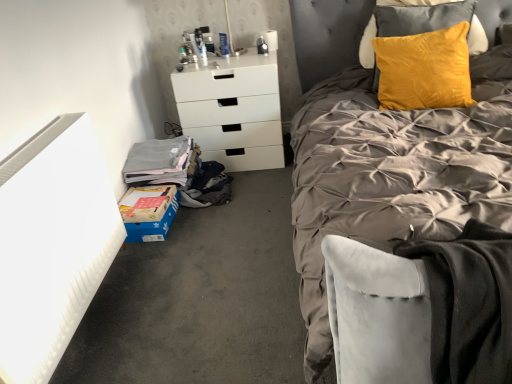
This screenshot has width=512, height=384. What are the coordinates of `free point in front of blue cardboard box at lower left` in the screenshot? It's located at (154, 254).